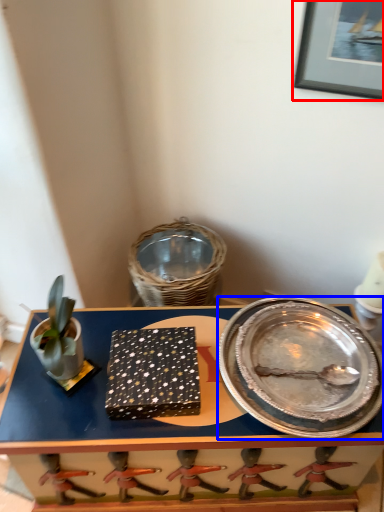
Question: Among these objects, which one is farthest to the camera, picture frame (highlighted by a red box) or platter (highlighted by a blue box)?

Choices:
 (A) picture frame
 (B) platter

Answer: (B)